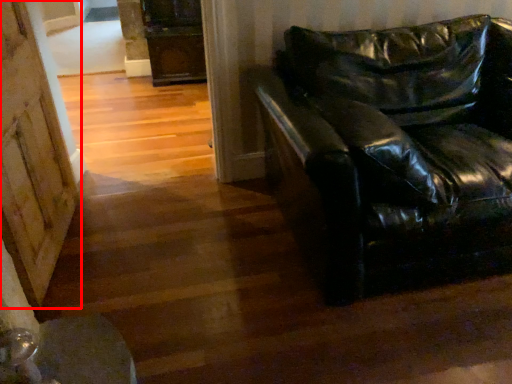
Question: Observing the image, what is the correct spatial positioning of barn door (annotated by the red box) in reference to studio couch?

Choices:
 (A) right
 (B) left

Answer: (B)